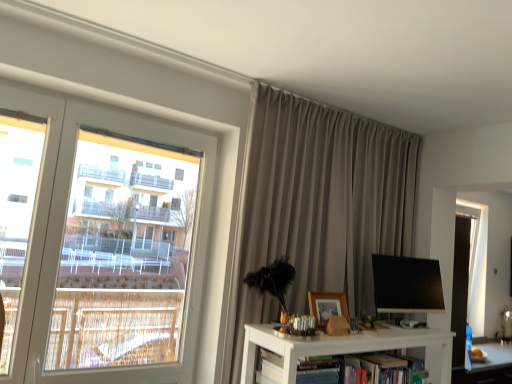
What do you see at coordinates (100, 243) in the screenshot?
I see `white plastic window at left` at bounding box center [100, 243].

Measure the distance between white plastic window at left and camera.

6.19 feet.

Describe the element at coordinates (327, 306) in the screenshot. I see `wooden picture frame at center` at that location.

At what (x,y) coordinates should I click in order to perform the action: click on black glossy monitor at center. Please return your answer as a coordinate pair (x, y). Looking at the image, I should click on (407, 284).

The width and height of the screenshot is (512, 384). Find the location of `matte gray curtain at upper center`. matte gray curtain at upper center is located at coordinates (322, 201).

What is the approximate height of matte gray curtain at upper center?

It is 1.60 meters.

The image size is (512, 384). I want to click on white plastic window at left, so click(100, 243).

Considering the relative positions of hardcover book at center and black glossy monitor at center in the image provided, is hardcover book at center to the left or to the right of black glossy monitor at center?

In the image, hardcover book at center appears on the left side of black glossy monitor at center.

Can we say hardcover book at center lies outside black glossy monitor at center?

Indeed, hardcover book at center is completely outside black glossy monitor at center.

From the image's perspective, is hardcover book at center over black glossy monitor at center?

Actually, hardcover book at center appears below black glossy monitor at center in the image.

Is the depth of hardcover book at center greater than that of white plastic window at left?

Yes, hardcover book at center is behind white plastic window at left.

Is hardcover book at center far from white plastic window at left?

Yes, hardcover book at center is far from white plastic window at left.

How many degrees apart are the facing directions of hardcover book at center and white plastic window at left?

hardcover book at center and white plastic window at left are facing 0.000174 degrees away from each other.

In the scene shown: Could you tell me if wooden picture frame at center is facing black glossy monitor at center?

No, wooden picture frame at center is not aimed at black glossy monitor at center.

Looking at this image, in terms of height, does wooden picture frame at center look taller or shorter compared to black glossy monitor at center?

Clearly, wooden picture frame at center is shorter compared to black glossy monitor at center.

Which object is further away from the camera taking this photo, wooden picture frame at center or black glossy monitor at center?

black glossy monitor at center is behind.

How different are the orientations of wooden picture frame at center and black glossy monitor at center in degrees?

The angular difference between wooden picture frame at center and black glossy monitor at center is 2.01 degrees.

Is wooden picture frame at center inside white plastic window at left?

That's incorrect, wooden picture frame at center is not inside white plastic window at left.

Considering the sizes of white plastic window at left and wooden picture frame at center in the image, is white plastic window at left bigger or smaller than wooden picture frame at center?

Considering their sizes, white plastic window at left takes up more space than wooden picture frame at center.

Which of these two, white plastic window at left or wooden picture frame at center, is thinner?

Thinner between the two is white plastic window at left.

Is point (146, 121) positioned behind point (318, 305)?

Yes, point (146, 121) is farther from viewer.

From the image's perspective, is hardcover book at center located above matte gray curtain at upper center?

Incorrect, from the image's perspective, hardcover book at center is lower than matte gray curtain at upper center.

Where is `curtain that appears behind the hardcover book at center`? This screenshot has height=384, width=512. curtain that appears behind the hardcover book at center is located at coordinates (322, 201).

Does hardcover book at center turn towards matte gray curtain at upper center?

No, hardcover book at center does not turn towards matte gray curtain at upper center.

From a real-world perspective, between hardcover book at center and matte gray curtain at upper center, who is vertically lower?

In real-world perspective, hardcover book at center is lower.

Measure the distance from black glossy monitor at center to white plastic window at left.

black glossy monitor at center and white plastic window at left are 4.78 feet apart from each other.

Which is in front, black glossy monitor at center or white plastic window at left?

white plastic window at left is more forward.

From the image's perspective, which one is positioned higher, black glossy monitor at center or white plastic window at left?

white plastic window at left is shown above in the image.

From a real-world perspective, is black glossy monitor at center above or below white plastic window at left?

black glossy monitor at center is situated higher than white plastic window at left in the real world.

Does black glossy monitor at center have a greater height compared to matte gray curtain at upper center?

Incorrect, the height of black glossy monitor at center is not larger of that of matte gray curtain at upper center.

From a real-world perspective, is black glossy monitor at center under matte gray curtain at upper center?

Yes, from a real-world perspective, black glossy monitor at center is below matte gray curtain at upper center.

Between black glossy monitor at center and matte gray curtain at upper center, which one has larger size?

matte gray curtain at upper center.

Is the position of black glossy monitor at center more distant than that of matte gray curtain at upper center?

Yes, black glossy monitor at center is further from the camera.

Image resolution: width=512 pixels, height=384 pixels. I want to click on book that is in front of the black glossy monitor at center, so click(362, 369).

Locate an element on the screen. This screenshot has height=384, width=512. book behind the white plastic window at left is located at coordinates (362, 369).

Considering their positions, is black glossy monitor at center positioned closer to white plastic window at left than wooden picture frame at center?

wooden picture frame at center.

Looking at the image, which one is located further to wooden picture frame at center, hardcover book at center or matte gray curtain at upper center?

Based on the image, matte gray curtain at upper center appears to be further to wooden picture frame at center.

Considering their positions, is black glossy monitor at center positioned further to wooden picture frame at center than white plastic window at left?

white plastic window at left is positioned further to the anchor wooden picture frame at center.

Which object lies nearer to the anchor point black glossy monitor at center, wooden picture frame at center or matte gray curtain at upper center?

matte gray curtain at upper center lies closer to black glossy monitor at center than the other object.

Estimate the real-world distances between objects in this image. Which object is further from hardcover book at center, white plastic window at left or wooden picture frame at center?

white plastic window at left lies further to hardcover book at center than the other object.

When comparing their distances from white plastic window at left, does matte gray curtain at upper center or wooden picture frame at center seem closer?

Based on the image, matte gray curtain at upper center appears to be nearer to white plastic window at left.

Estimate the real-world distances between objects in this image. Which object is closer to black glossy monitor at center, wooden picture frame at center or white plastic window at left?

wooden picture frame at center lies closer to black glossy monitor at center than the other object.

Looking at this image, from the image, which object appears to be farther from wooden picture frame at center, white plastic window at left or black glossy monitor at center?

Based on the image, white plastic window at left appears to be further to wooden picture frame at center.

The height and width of the screenshot is (384, 512). I want to click on curtain between wooden picture frame at center and black glossy monitor at center from left to right, so click(x=322, y=201).

At what (x,y) coordinates should I click in order to perform the action: click on book located between white plastic window at left and black glossy monitor at center in the left-right direction. Please return your answer as a coordinate pair (x, y). The image size is (512, 384). Looking at the image, I should click on (362, 369).

Find the location of a particular element. The image size is (512, 384). picture frame between white plastic window at left and hardcover book at center in the horizontal direction is located at coordinates (327, 306).

Find the location of a particular element. curtain between white plastic window at left and hardcover book at center is located at coordinates (322, 201).